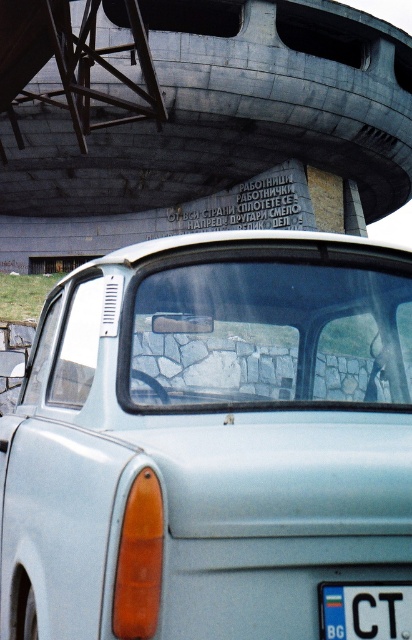
Question: Which object is closer to the camera taking this photo?

Choices:
 (A) white plastic license plate at center
 (B) satin silver car at center
 (C) gray concrete overpass at upper center

Answer: (B)

Question: Can you confirm if gray concrete overpass at upper center is positioned to the right of white plastic license plate at center?

Choices:
 (A) yes
 (B) no

Answer: (B)

Question: From the image, what is the correct spatial relationship of satin silver car at center in relation to gray concrete overpass at upper center?

Choices:
 (A) left
 (B) right

Answer: (B)

Question: Which object is the closest to the white plastic license plate at center?

Choices:
 (A) gray concrete overpass at upper center
 (B) satin silver car at center

Answer: (B)

Question: Considering the real-world distances, which object is farthest from the gray concrete overpass at upper center?

Choices:
 (A) white plastic license plate at center
 (B) satin silver car at center

Answer: (B)

Question: Observing the image, what is the correct spatial positioning of satin silver car at center in reference to gray concrete overpass at upper center?

Choices:
 (A) right
 (B) left

Answer: (A)